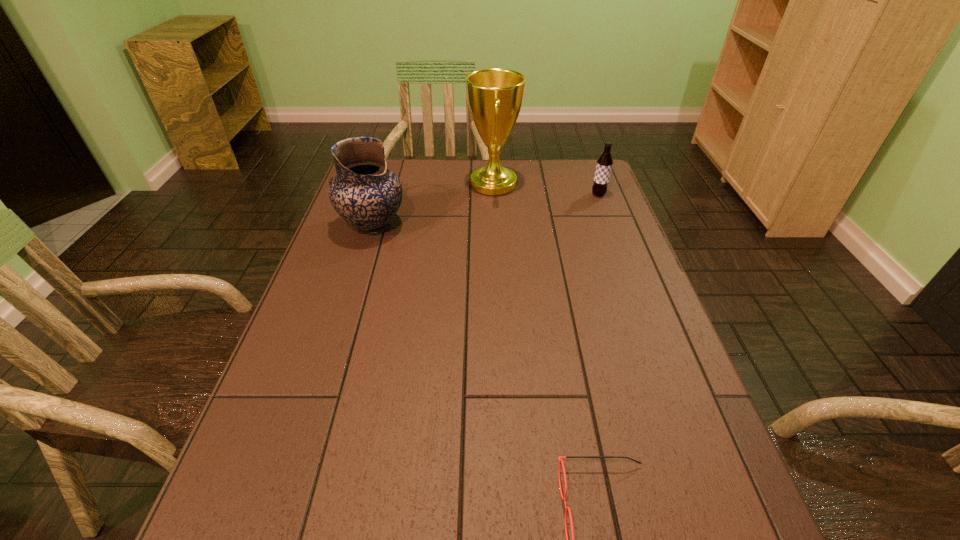
This screenshot has height=540, width=960. In order to click on free space between the second object from left to right and the root beer in this screenshot , I will do `click(546, 189)`.

Locate an element on the screen. The height and width of the screenshot is (540, 960). free space between the rightmost object and the pottery is located at coordinates (486, 210).

The height and width of the screenshot is (540, 960). In order to click on free space between the pottery and the third object from right to left in this screenshot , I will do `click(433, 205)`.

The image size is (960, 540). What are the coordinates of `vacant area between the pottery and the third object from right to left` in the screenshot? It's located at (433, 205).

Locate an element on the screen. The image size is (960, 540). vacant region between the tallest object and the pottery is located at coordinates (433, 205).

Find the location of a particular element. The width and height of the screenshot is (960, 540). object that stands as the second closest to the nearest object is located at coordinates (495, 96).

Find the location of `the second closest object to the nearest object`. the second closest object to the nearest object is located at coordinates (495, 96).

The height and width of the screenshot is (540, 960). I want to click on free spot that satisfies the following two spatial constraints: 1. by the handles of the root beer; 2. on the right side of the tallest object, so click(493, 194).

I want to click on blank area in the image that satisfies the following two spatial constraints: 1. by the handles of the tallest object; 2. on the back side of the second shortest object, so click(x=493, y=194).

At what (x,y) coordinates should I click in order to perform the action: click on free point that satisfies the following two spatial constraints: 1. on the back side of the second shortest object; 2. by the handles of the tallest object. Please return your answer as a coordinate pair (x, y). Image resolution: width=960 pixels, height=540 pixels. Looking at the image, I should click on [x=594, y=184].